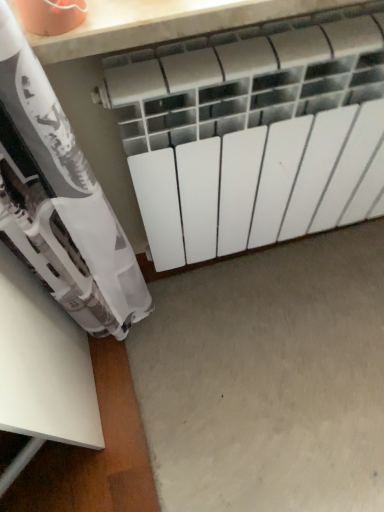
Question: Based on their sizes in the image, would you say gray matte concrete at center is bigger or smaller than white matte radiator at center?

Choices:
 (A) big
 (B) small

Answer: (B)

Question: Is point (215, 382) positioned closer to the camera than point (238, 105)?

Choices:
 (A) closer
 (B) farther

Answer: (B)

Question: Would you say gray matte concrete at center is to the left or to the right of white matte radiator at center in the picture?

Choices:
 (A) left
 (B) right

Answer: (B)

Question: Do you think white matte radiator at center is within gray matte concrete at center, or outside of it?

Choices:
 (A) inside
 (B) outside

Answer: (B)

Question: Is white matte radiator at center to the left or to the right of gray matte concrete at center in the image?

Choices:
 (A) left
 (B) right

Answer: (A)

Question: Is white matte radiator at center wider or thinner than gray matte concrete at center?

Choices:
 (A) thin
 (B) wide

Answer: (A)

Question: Does point (357, 129) appear closer or farther from the camera than point (264, 490)?

Choices:
 (A) closer
 (B) farther

Answer: (A)